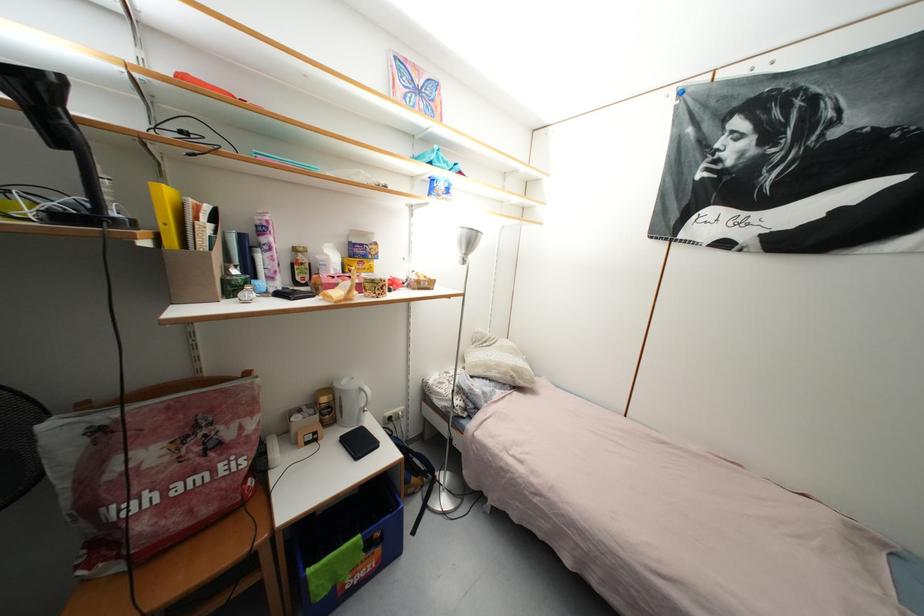
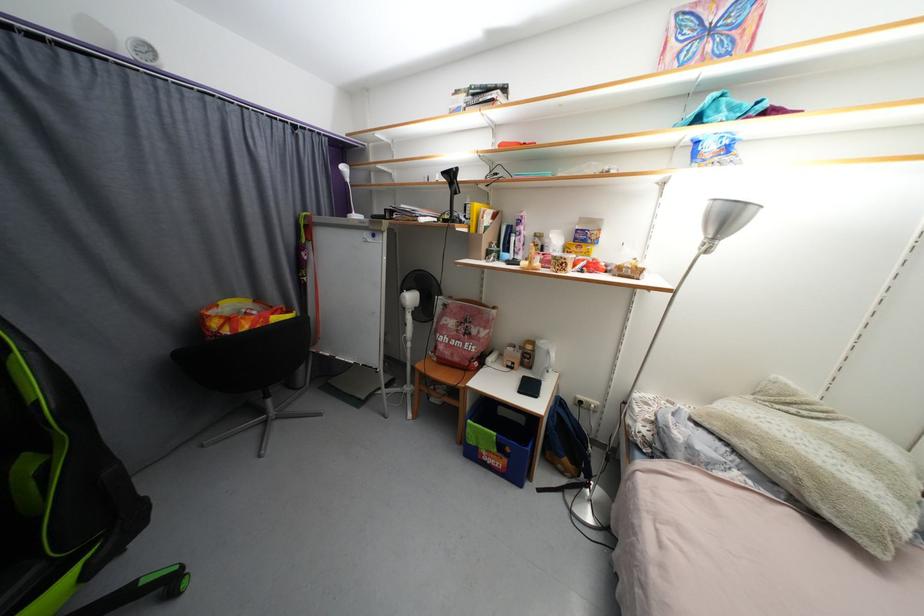
The point at (334,392) is marked in the first image. Where is the corresponding point in the second image?

(538, 344)